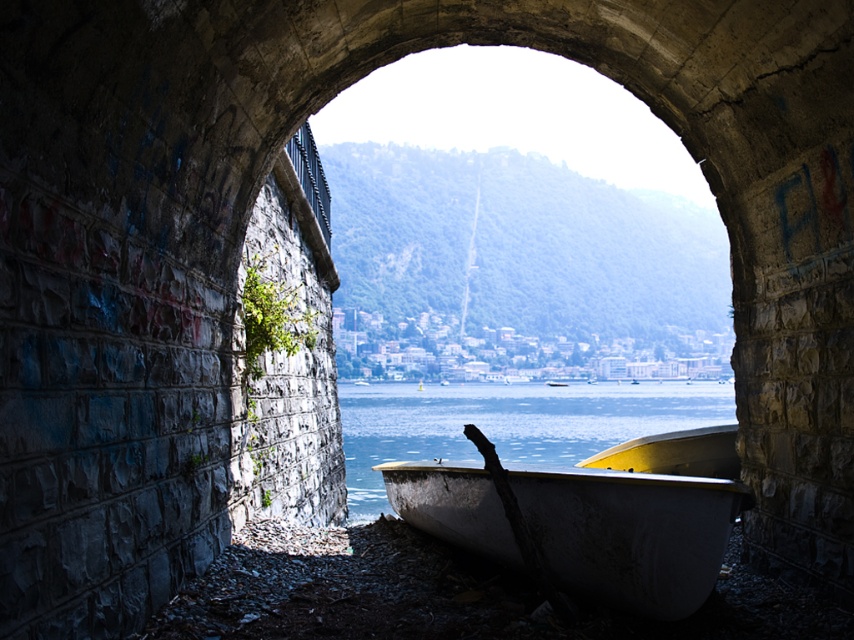
Find the location of a particular element. The height and width of the screenshot is (640, 854). white weathered canoe at lower right is located at coordinates (629, 532).

Is white weathered canoe at lower right above clear water at boat right?

Yes, white weathered canoe at lower right is above clear water at boat right.

What do you see at coordinates (629, 532) in the screenshot?
I see `white weathered canoe at lower right` at bounding box center [629, 532].

Locate an element on the screen. The width and height of the screenshot is (854, 640). white weathered canoe at lower right is located at coordinates (x=629, y=532).